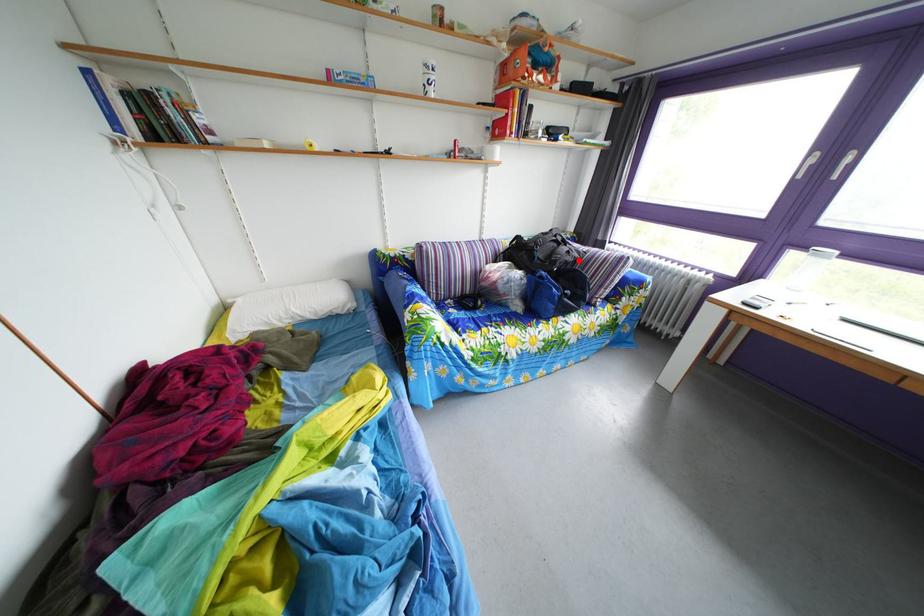
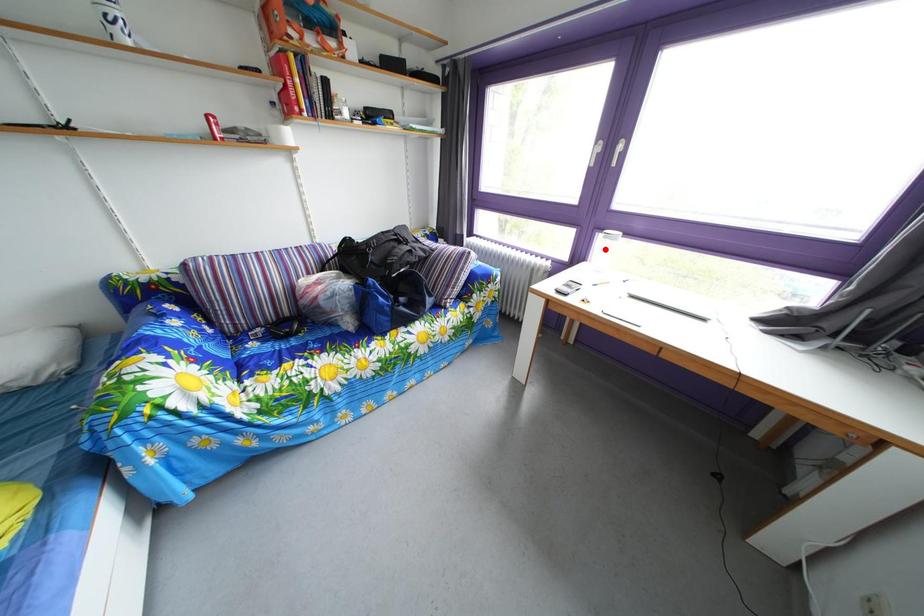
I am providing you with two images of the same scene from different viewpoints. A red point is marked on the first image and another point is marked on the second image. Are the points marked in image1 and image2 representing the same 3D position?

No